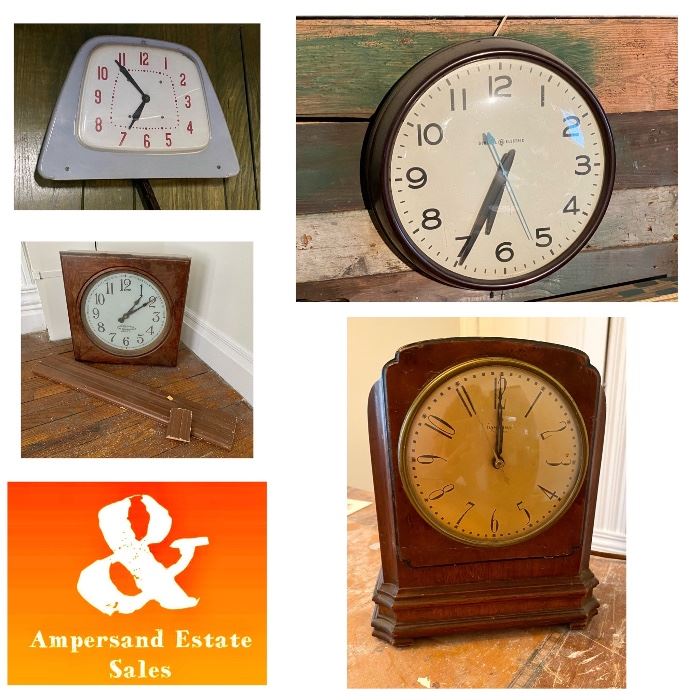
At what (x,y) coordinates should I click in order to perform the action: click on clock. Please return your answer as a coordinate pair (x, y). The height and width of the screenshot is (700, 700). Looking at the image, I should click on (462, 145), (169, 110), (150, 309), (477, 449).